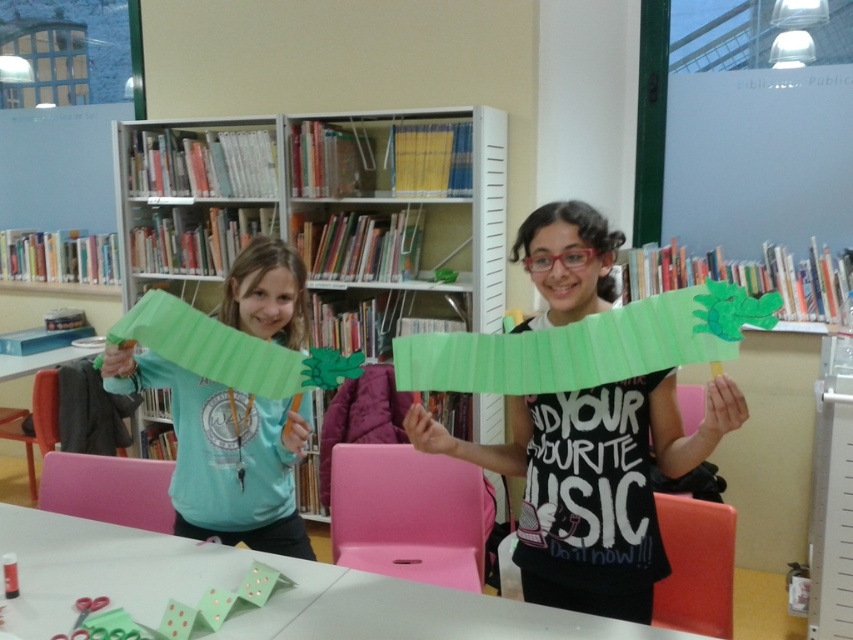
You are a visitor in the library and want to place a small gift on the white matte table at lower center. Based on the coordinates provided in the description, can you determine if the table is positioned near the center of the room?

The white matte table at lower center is located at point coordinates of [270,595], which suggests it is positioned closer to the right side of the room rather than the center. Therefore, the table is not near the center of the room.

Looking at the scene, where is the green paper craft at center in relation to the white matte table at lower center?

The green paper craft at center is to the right of the white matte table at lower center.